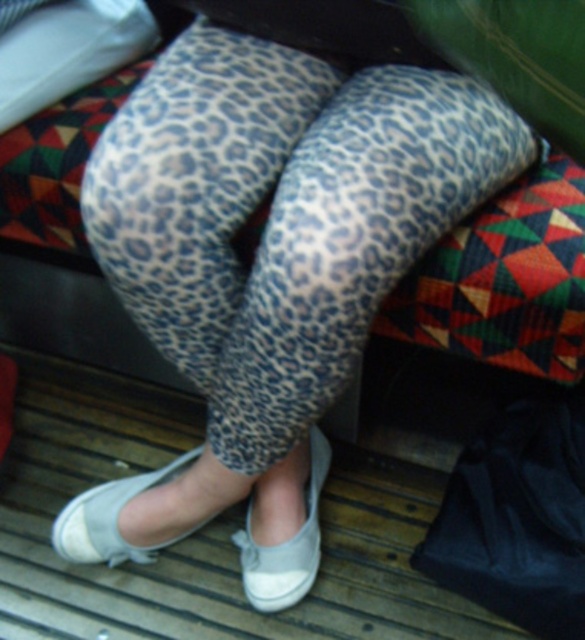
Which is below, gray fabric shoe at lower center or white fabric sock at lower center?

gray fabric shoe at lower center

Where is `gray fabric shoe at lower center`? This screenshot has width=585, height=640. gray fabric shoe at lower center is located at coordinates (287, 545).

Who is higher up, white canvas shoe at lower center or gray fabric shoe at lower center?

Positioned higher is white canvas shoe at lower center.

Is white canvas shoe at lower center to the right of gray fabric shoe at lower center from the viewer's perspective?

In fact, white canvas shoe at lower center is to the left of gray fabric shoe at lower center.

Locate an element on the screen. The width and height of the screenshot is (585, 640). white canvas shoe at lower center is located at coordinates (118, 513).

Is leopard print leggings at center positioned in front of white canvas shoe at lower center?

Yes, leopard print leggings at center is in front of white canvas shoe at lower center.

Where is `leopard print leggings at center`? This screenshot has width=585, height=640. leopard print leggings at center is located at coordinates click(280, 216).

Describe the element at coordinates (280, 216) in the screenshot. I see `leopard print leggings at center` at that location.

The width and height of the screenshot is (585, 640). Identify the location of leopard print leggings at center. (280, 216).